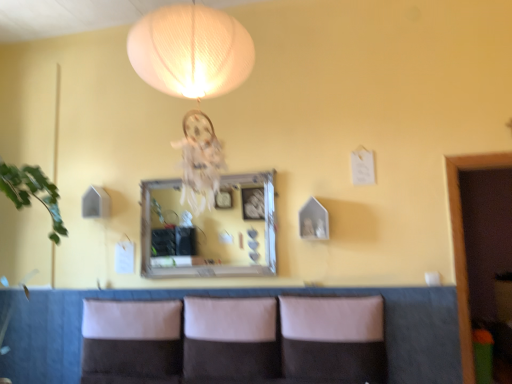
Question: Would you say wooden-framed mirror at center contains leather-like brown couch at lower center?

Choices:
 (A) yes
 (B) no

Answer: (B)

Question: From a real-world perspective, is wooden-framed mirror at center under leather-like brown couch at lower center?

Choices:
 (A) yes
 (B) no

Answer: (B)

Question: Does wooden-framed mirror at center touch leather-like brown couch at lower center?

Choices:
 (A) no
 (B) yes

Answer: (A)

Question: Can you confirm if wooden-framed mirror at center is bigger than leather-like brown couch at lower center?

Choices:
 (A) yes
 (B) no

Answer: (B)

Question: Considering the relative sizes of wooden-framed mirror at center and leather-like brown couch at lower center in the image provided, is wooden-framed mirror at center taller than leather-like brown couch at lower center?

Choices:
 (A) no
 (B) yes

Answer: (B)

Question: Is wooden-framed mirror at center far from leather-like brown couch at lower center?

Choices:
 (A) no
 (B) yes

Answer: (A)

Question: From the image's perspective, is leather-like beige pillow at center, the 1th pillow from the right, located beneath white fabric pillow at lower center, which is counted as the 3th pillow, starting from the right?

Choices:
 (A) yes
 (B) no

Answer: (B)

Question: Is leather-like beige pillow at center, which is the 3th pillow from left to right, facing away from white fabric pillow at lower center, which is the first pillow in left-to-right order?

Choices:
 (A) yes
 (B) no

Answer: (B)

Question: Is leather-like beige pillow at center, the 1th pillow from the right, thinner than white fabric pillow at lower center, which is the first pillow in left-to-right order?

Choices:
 (A) yes
 (B) no

Answer: (B)

Question: From a real-world perspective, is leather-like beige pillow at center, which is the 3th pillow from left to right, located higher than white fabric pillow at lower center, which is the first pillow in left-to-right order?

Choices:
 (A) yes
 (B) no

Answer: (A)

Question: Does leather-like beige pillow at center, which is the 3th pillow from left to right, contain white fabric pillow at lower center, which is the first pillow in left-to-right order?

Choices:
 (A) no
 (B) yes

Answer: (A)

Question: From the image's perspective, does leather-like beige pillow at center, which is the 3th pillow from left to right, appear higher than white fabric pillow at lower center, which is the first pillow in left-to-right order?

Choices:
 (A) no
 (B) yes

Answer: (B)

Question: From the image's perspective, is leather-like brown couch at lower center under leather-like beige pillow at center, the 1th pillow from the right?

Choices:
 (A) no
 (B) yes

Answer: (B)